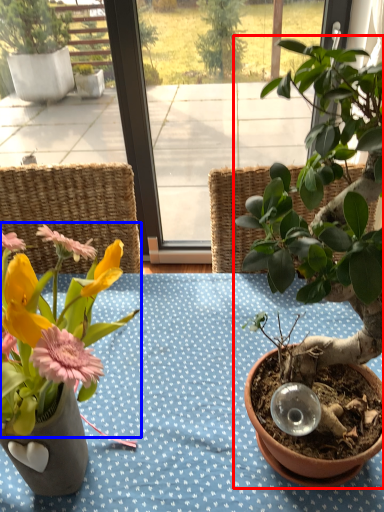
Question: Which object appears closest to the camera in this image, houseplant (highlighted by a red box) or flower (highlighted by a blue box)?

Choices:
 (A) houseplant
 (B) flower

Answer: (A)